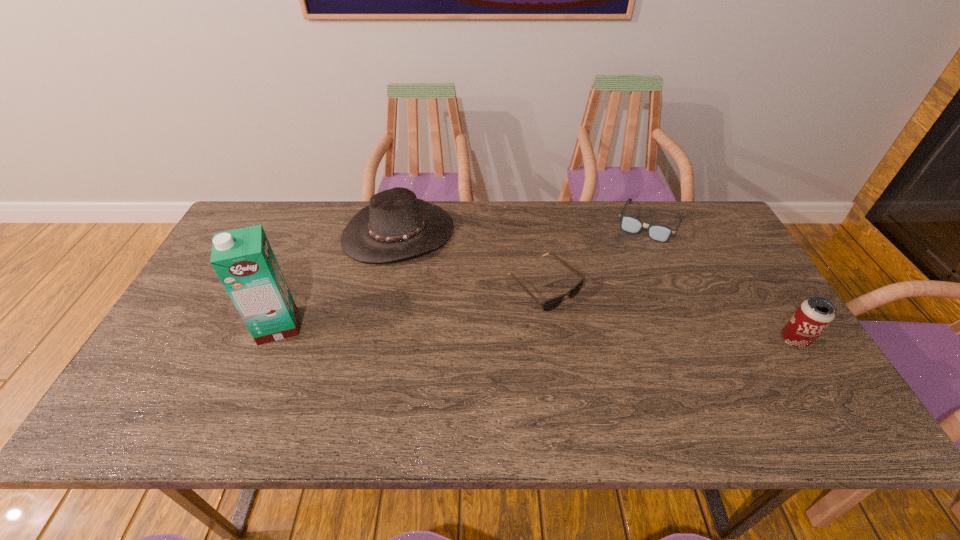
At what (x,y) coordinates should I click in order to perform the action: click on carton. Please return your answer as a coordinate pair (x, y). Looking at the image, I should click on (243, 259).

Locate an element on the screen. The image size is (960, 540). the tallest object is located at coordinates (243, 259).

Locate an element on the screen. the rightmost object is located at coordinates (813, 316).

I want to click on the second object from left to right, so click(395, 225).

Where is `the third object from left to right`? Image resolution: width=960 pixels, height=540 pixels. the third object from left to right is located at coordinates (552, 303).

Identify the location of sunglasses. (552, 303).

Find the location of a particular element. This screenshot has width=960, height=540. the second object from right to left is located at coordinates tap(660, 233).

At what (x,y) coordinates should I click in order to perform the action: click on the second shortest object. Please return your answer as a coordinate pair (x, y). Looking at the image, I should click on pos(660,233).

This screenshot has height=540, width=960. Identify the location of free space located on the back of the carton. (296, 284).

I want to click on vacant space positioned 0.180m on the left of the rightmost object, so click(708, 341).